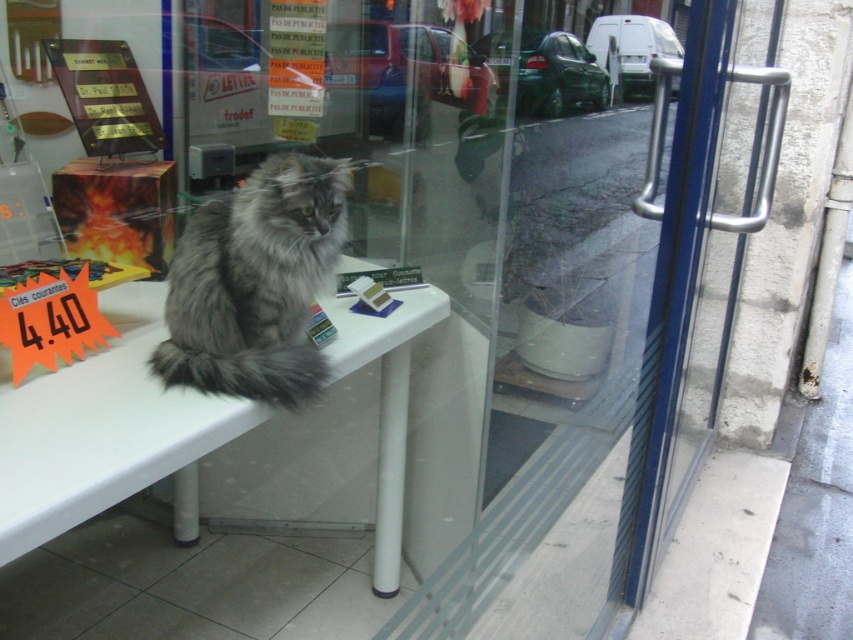
In the scene shown: You are a customer entering the shop and want to place a small gift box on the table without disturbing the cat. Given the sizes of the white plastic table at center and the fuzzy gray cat at center, do you think there is enough space on the table to place the gift box?

The white plastic table at center has a larger size compared to the fuzzy gray cat at center, so there should be enough space on the table to place the gift box without disturbing the cat.

You are standing outside the shop looking through the glass storefront. Where is the white plastic table at center located in the image?

The white plastic table at center is located at point 0.680 on the x axis and 0.124 on the y axis.

From the picture: You are a delivery person who needs to place a small package on the white plastic table at center without disturbing the fuzzy gray cat at center. The package is 10 inches long. Is there enough space between the cat and the edge of the table to safely place the package?

The distance between the white plastic table at center and fuzzy gray cat at center is 8.08 inches. Since the package is 10 inches long, which is longer than the available space, you cannot safely place the package there without disturbing the cat.